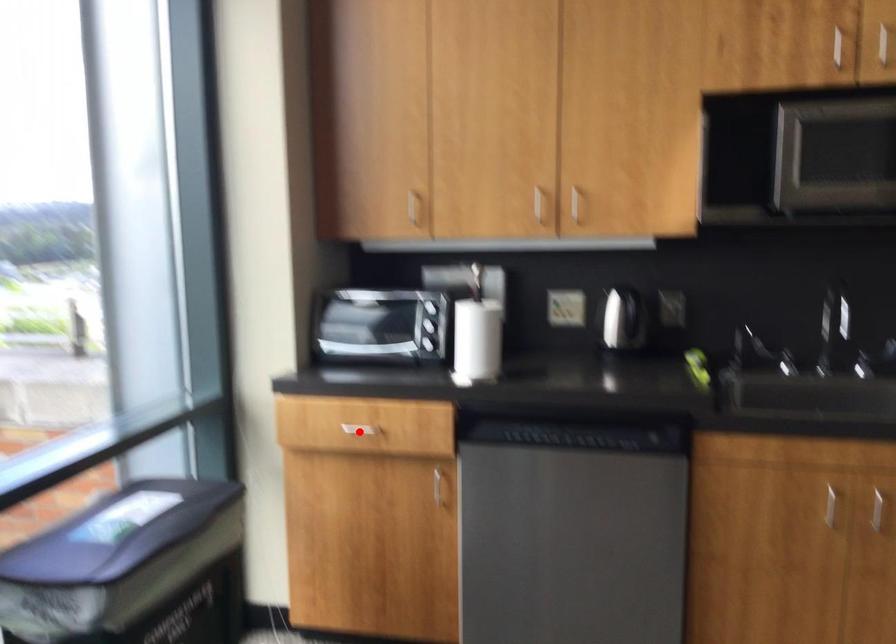
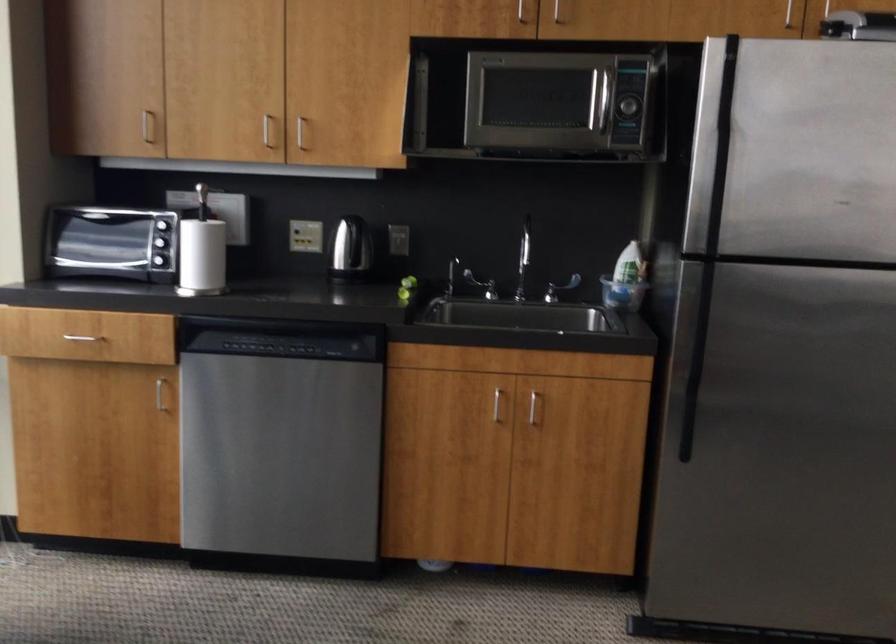
Where in the second image is the point corresponding to the highlighted location from the first image?

(82, 337)